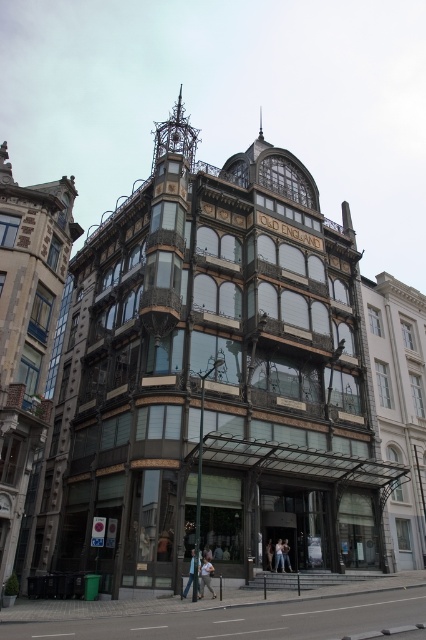
Question: Does light blue jeans at lower center lie in front of light beige fabric jacket at center?

Choices:
 (A) no
 (B) yes

Answer: (B)

Question: Which is nearer to the light blue jeans at lower center?

Choices:
 (A) light brown leather jacket at center
 (B) light blue denim jeans at lower center
 (C) light beige fabric dress at center
 (D) light blue jeans at center

Answer: (A)

Question: Is gold metallic clock at upper center above light beige fabric jacket at center?

Choices:
 (A) no
 (B) yes

Answer: (B)

Question: Which object appears farthest from the camera in this image?

Choices:
 (A) gold metallic clock at upper center
 (B) light beige fabric jacket at center
 (C) light blue denim jeans at lower center
 (D) light blue jeans at lower center

Answer: (C)

Question: Does gold metallic clock at upper center appear on the right side of light beige fabric dress at center?

Choices:
 (A) no
 (B) yes

Answer: (A)

Question: Which object appears farthest from the camera in this image?

Choices:
 (A) light beige fabric jacket at center
 (B) light blue jeans at lower center
 (C) light blue denim jeans at lower center
 (D) light beige fabric dress at center

Answer: (C)